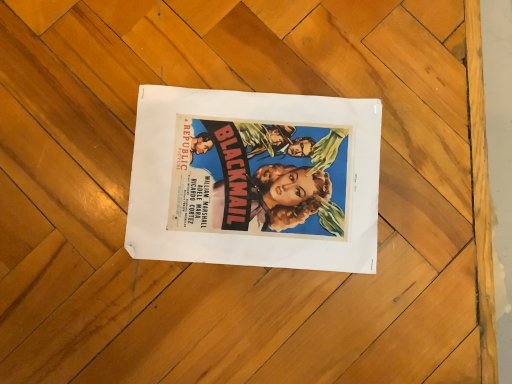
This screenshot has height=384, width=512. In order to click on blank space situated above matte paper poster at center (from a real-world perspective) in this screenshot , I will do `click(257, 166)`.